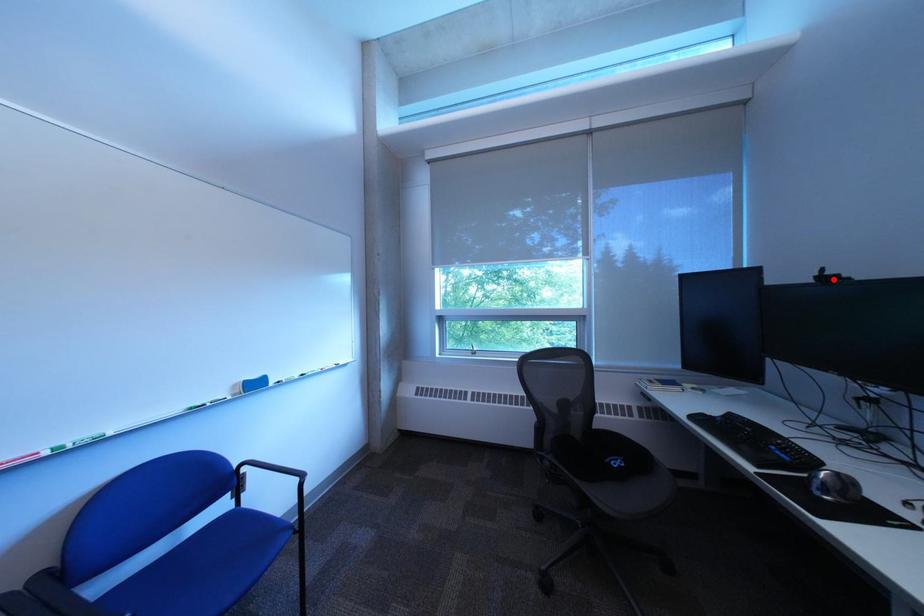
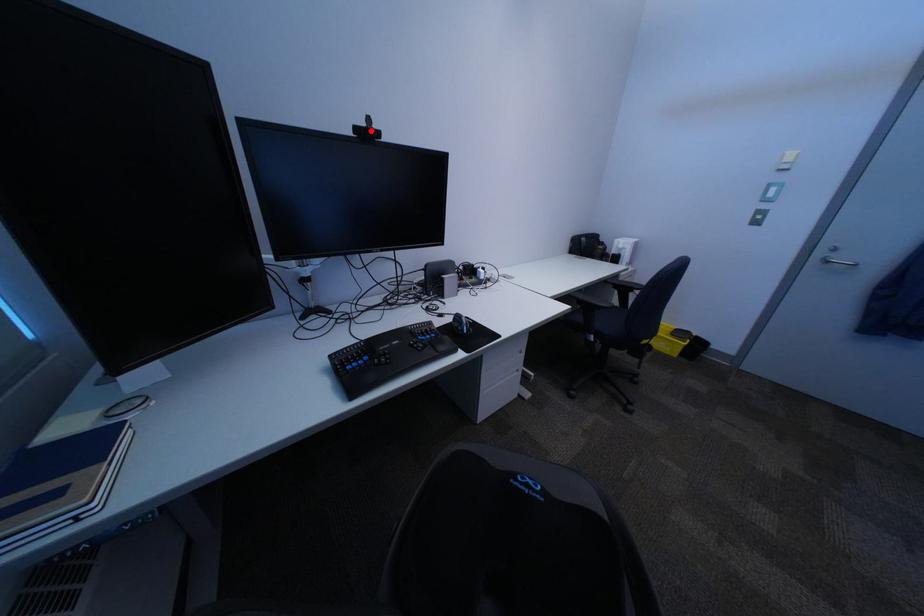
I am providing you with two images of the same scene from different viewpoints. A red point is marked on the first image and another point is marked on the second image. Does the point marked in image1 correspond to the same location as the one in image2?

Yes